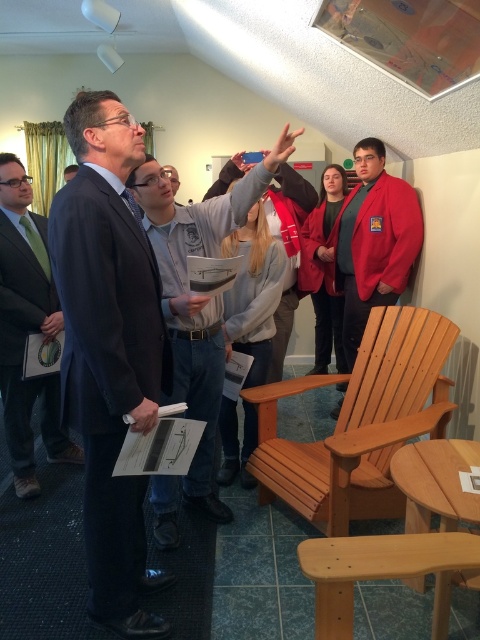
Is light brown wooden chair at lower right further to the viewer compared to red cotton jacket at right?

No, it is not.

Is light brown wooden chair at lower right thinner than red cotton jacket at right?

In fact, light brown wooden chair at lower right might be wider than red cotton jacket at right.

Who is more distant from viewer, (412, 362) or (408, 266)?

Positioned behind is point (408, 266).

Image resolution: width=480 pixels, height=640 pixels. Find the location of `light brown wooden chair at lower right`. light brown wooden chair at lower right is located at coordinates (359, 422).

Which is in front, point (336, 444) or point (14, 196)?

Point (336, 444) is in front.

Locate an element on the screen. light brown wooden chair at lower right is located at coordinates (359, 422).

Who is higher up, red cotton jacket at right or gray fleece sweatshirt at center?

red cotton jacket at right is higher up.

Is point (376, 193) less distant than point (254, 248)?

No.

Locate an element on the screen. This screenshot has height=640, width=480. red cotton jacket at right is located at coordinates (372, 243).